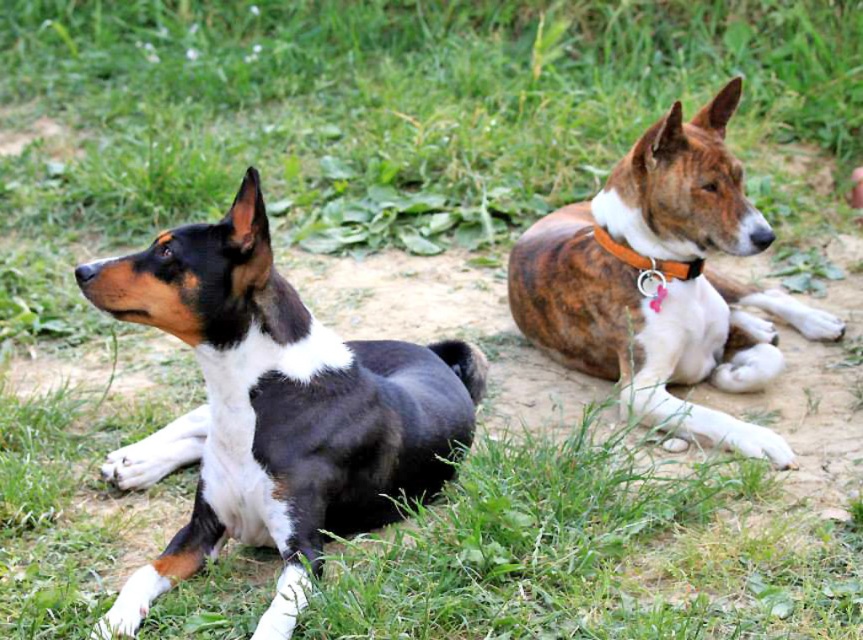
Question: Which object is farther from the camera taking this photo?

Choices:
 (A) black and white fur dog at left
 (B) brown brindle dog at right
 (C) orange fabric collar at upper right

Answer: (C)

Question: Can you confirm if black and white fur dog at left is smaller than orange fabric collar at upper right?

Choices:
 (A) no
 (B) yes

Answer: (A)

Question: Which of the following is the closest to the observer?

Choices:
 (A) orange fabric collar at upper right
 (B) black and white fur dog at left

Answer: (B)

Question: Which of the following is the farthest from the observer?

Choices:
 (A) brown brindle dog at right
 (B) black and white fur dog at left
 (C) orange fabric collar at upper right

Answer: (C)

Question: Does black and white fur dog at left appear on the left side of orange fabric collar at upper right?

Choices:
 (A) yes
 (B) no

Answer: (A)

Question: Can you confirm if brown brindle dog at right is positioned to the right of orange fabric collar at upper right?

Choices:
 (A) yes
 (B) no

Answer: (A)